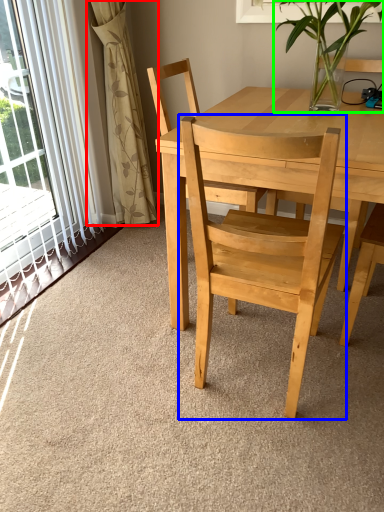
Question: Estimate the real-world distances between objects in this image. Which object is farther from curtain (highlighted by a red box), chair (highlighted by a blue box) or houseplant (highlighted by a green box)?

Choices:
 (A) chair
 (B) houseplant

Answer: (A)